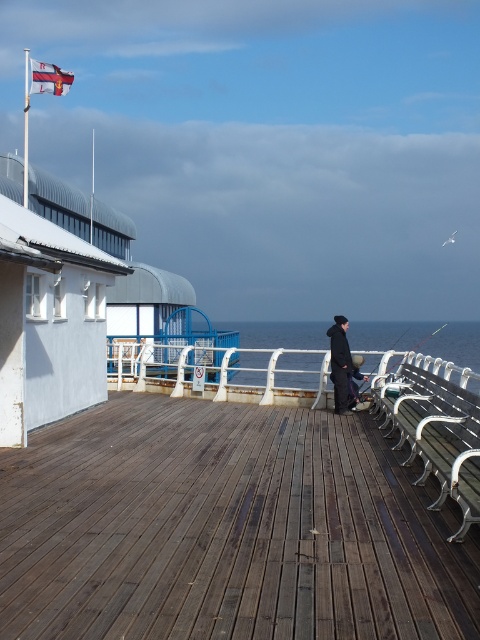
You are standing on the brown wooden deck at center and want to hang a dark blue fabric coat at center on a hook. Where should you place the hook relative to the deck?

The dark blue fabric coat at center should be placed above the brown wooden deck at center since the deck is below the coat.

You are a photographer planning to capture the brown wooden deck at center and the dark blue fabric coat at center in a single frame. Based on their sizes in the image, which object would require you to adjust your camera angle to include more of its details without cropping?

The dark blue fabric coat at center requires adjusting the camera angle to include more details because it occupies more space in the image than the brown wooden deck at center.

You are a tourist visiting the seaside and want to sit down. You see the green metal bench at right and the metallic fishing pole at right. Which object is narrower?

The green metal bench at right has a lesser width compared to the metallic fishing pole at right, so the green metal bench at right is narrower.